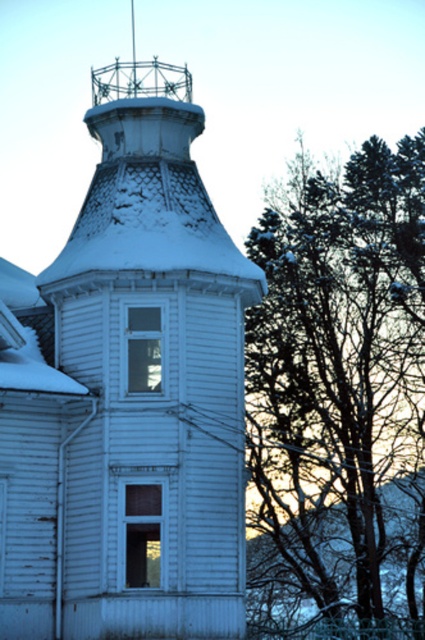
Which is in front, point (127, 84) or point (377, 580)?

Positioned in front is point (127, 84).

Is white wooden tower at center bigger than snow-covered branches at upper right?

No, white wooden tower at center is not bigger than snow-covered branches at upper right.

Does point (79, 234) come behind point (391, 404)?

No, (79, 234) is in front of (391, 404).

This screenshot has height=640, width=425. Find the location of `white wooden tower at center`. white wooden tower at center is located at coordinates (127, 392).